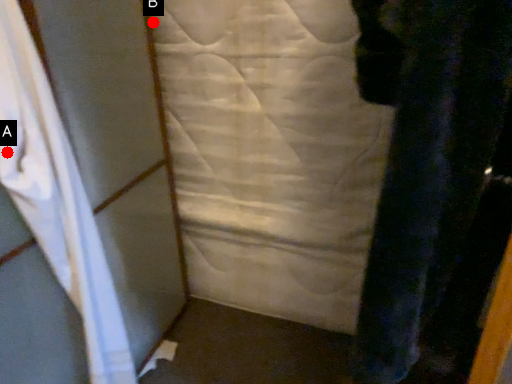
Question: Two points are circled on the image, labeled by A and B beside each circle. Which point is farther to the camera?

Choices:
 (A) A is further
 (B) B is further

Answer: (B)